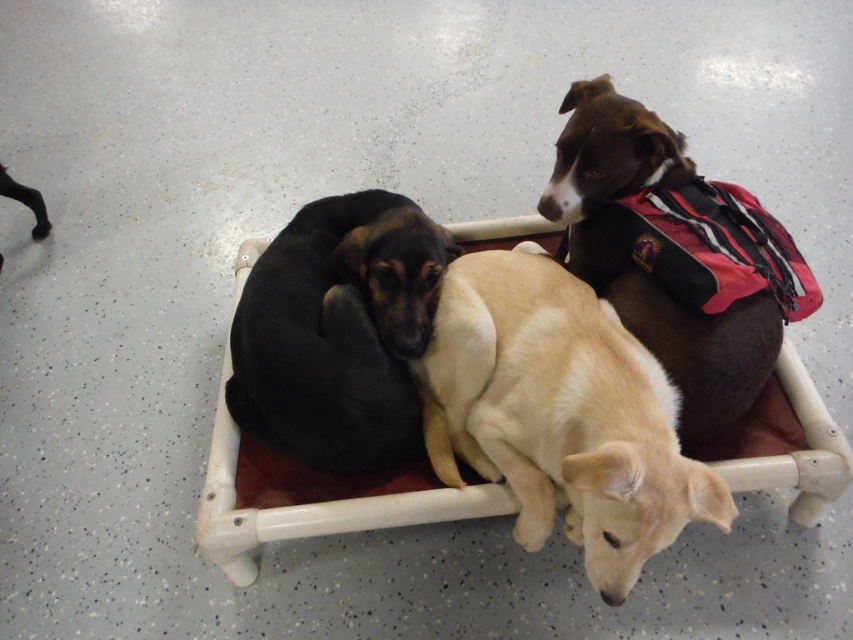
Which dog is positioned at the coordinates point (560, 413)?

The light brown fur at center is located at point (560, 413).